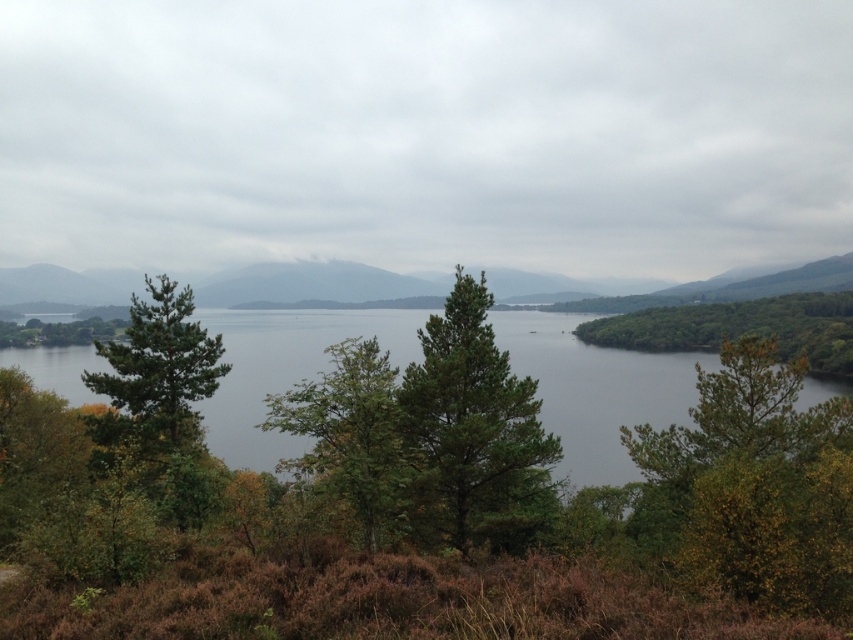
Question: Which object is positioned closest to the green matte tree at center?

Choices:
 (A) clear water at center
 (B) matte green mountain at center
 (C) green leafy tree at right

Answer: (A)

Question: In this image, where is clear water at center located relative to green leafy tree at center?

Choices:
 (A) right
 (B) left

Answer: (B)

Question: Where is clear water at center located in relation to green leafy tree at right in the image?

Choices:
 (A) above
 (B) below

Answer: (B)

Question: Which of the following is the farthest from the observer?

Choices:
 (A) matte green mountain at center
 (B) green matte tree at center
 (C) green matte tree at left
 (D) green leafy tree at right

Answer: (A)

Question: Which of the following is the farthest from the observer?

Choices:
 (A) (245, 291)
 (B) (521, 493)

Answer: (A)

Question: Is clear water at center positioned before green matte tree at center?

Choices:
 (A) yes
 (B) no

Answer: (A)